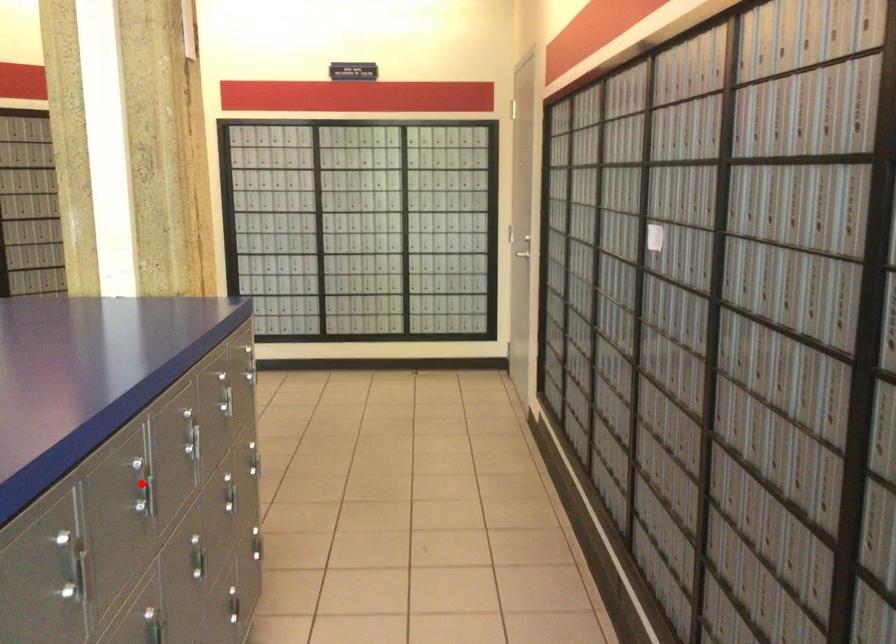
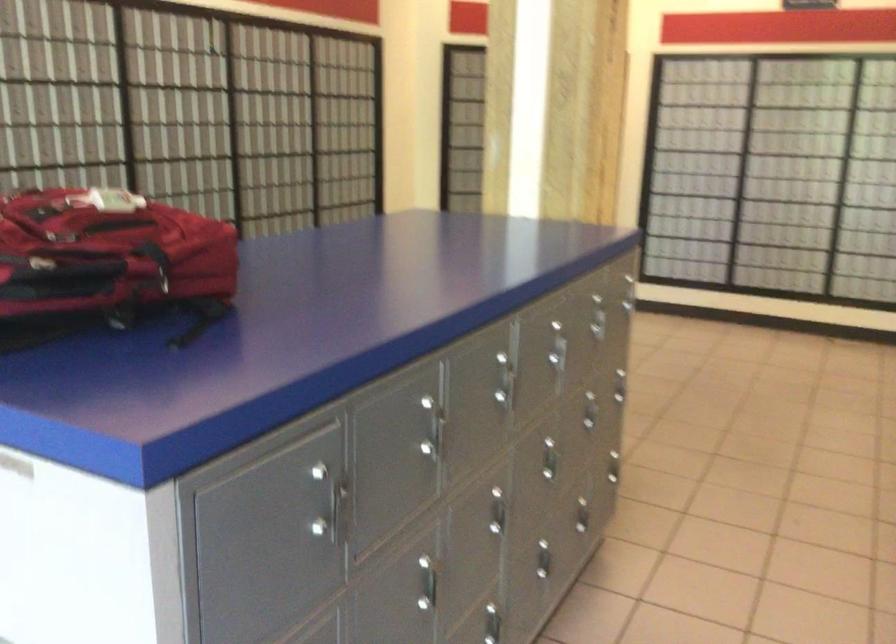
The point at the highlighted location is marked in the first image. Where is the corresponding point in the second image?

(503, 381)